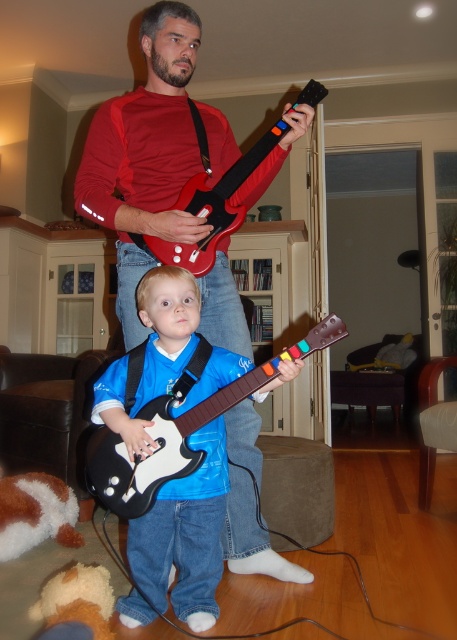
Based on the photo, is matte red guitar at center taller than black plastic guitar at center?

Yes, matte red guitar at center is taller than black plastic guitar at center.

Can you confirm if matte red guitar at center is thinner than black plastic guitar at center?

In fact, matte red guitar at center might be wider than black plastic guitar at center.

Does point (190, 138) come closer to viewer compared to point (169, 477)?

That is False.

This screenshot has width=457, height=640. I want to click on matte red guitar at center, so click(x=152, y=154).

At what (x,y) coordinates should I click in order to perform the action: click on rubberized black guitar at upper center. Please return your answer as a coordinate pair (x, y). Image resolution: width=457 pixels, height=640 pixels. Looking at the image, I should click on (214, 205).

Which is below, rubberized black guitar at upper center or brown plush toy at lower left?

brown plush toy at lower left is lower down.

Is point (226, 177) less distant than point (36, 508)?

Yes, point (226, 177) is closer to viewer.

Find the location of `rubberized black guitar at upper center`. rubberized black guitar at upper center is located at coordinates (214, 205).

Consider the image. Does matte red guitar at center come behind fluffy orange stuffed animal at lower left?

Yes, matte red guitar at center is behind fluffy orange stuffed animal at lower left.

Does matte red guitar at center appear on the left side of fluffy orange stuffed animal at lower left?

In fact, matte red guitar at center is to the right of fluffy orange stuffed animal at lower left.

Locate an element on the screen. matte red guitar at center is located at coordinates (152, 154).

What are the coordinates of `matte red guitar at center` in the screenshot? It's located at (152, 154).